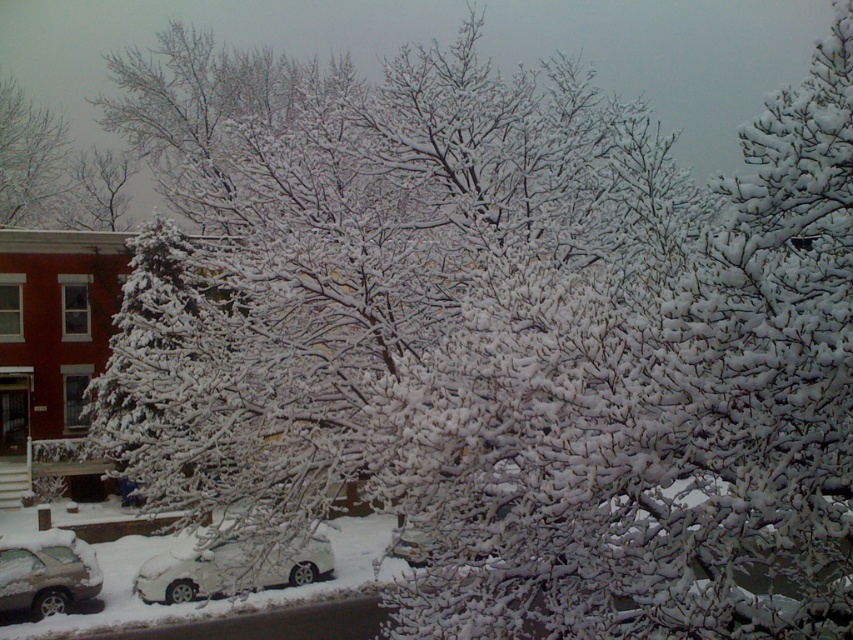
Question: Does white matte car at lower left appear on the right side of white snow-covered tree at upper left?

Choices:
 (A) no
 (B) yes

Answer: (B)

Question: Which object appears farthest from the camera in this image?

Choices:
 (A) silver metallic car at lower left
 (B) white matte car at lower left
 (C) white snow-covered tree at upper left

Answer: (C)

Question: Can you confirm if white matte car at lower left is bigger than white snow-covered tree at upper left?

Choices:
 (A) yes
 (B) no

Answer: (B)

Question: Estimate the real-world distances between objects in this image. Which object is closer to the silver metallic car at lower left?

Choices:
 (A) white matte car at lower left
 (B) white snow-covered tree at upper left

Answer: (A)

Question: Estimate the real-world distances between objects in this image. Which object is closer to the white matte car at lower left?

Choices:
 (A) white snow-covered tree at upper left
 (B) silver metallic car at lower left

Answer: (B)

Question: Does white snow-covered tree at upper left have a lesser width compared to silver metallic car at lower left?

Choices:
 (A) yes
 (B) no

Answer: (B)